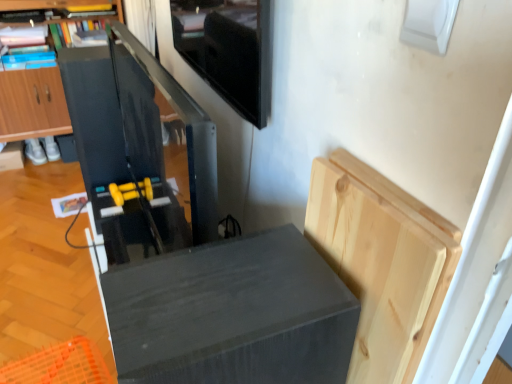
At what (x,y) coordinates should I click in order to perform the action: click on matte black cabinet at left, the 1th cabinetry in the left-to-right sequence. Please return your answer as a coordinate pair (x, y). This screenshot has height=384, width=512. Looking at the image, I should click on (32, 104).

Image resolution: width=512 pixels, height=384 pixels. What do you see at coordinates (32, 104) in the screenshot?
I see `matte black cabinet at left, the second cabinetry ordered from the bottom` at bounding box center [32, 104].

Identify the location of matte black speaker at lower center. (232, 314).

Where is `matte black cabinet at left, the 1th cabinetry in the left-to-right sequence`? Image resolution: width=512 pixels, height=384 pixels. matte black cabinet at left, the 1th cabinetry in the left-to-right sequence is located at coordinates (32, 104).

Can you confirm if matte black cabinet at left, arranged as the second cabinetry when viewed from the right, is wider than natural wood cutting board at upper right, positioned as the second cabinetry in back-to-front order?

Correct, the width of matte black cabinet at left, arranged as the second cabinetry when viewed from the right, exceeds that of natural wood cutting board at upper right, positioned as the second cabinetry in back-to-front order.

I want to click on cabinetry located behind the natural wood cutting board at upper right, positioned as the first cabinetry in front-to-back order, so click(x=32, y=104).

Between matte black cabinet at left, the 2th cabinetry positioned from the front, and natural wood cutting board at upper right, the 2th cabinetry positioned from the top, which one has more height?

matte black cabinet at left, the 2th cabinetry positioned from the front.

Can you tell me how much matte black cabinet at left, arranged as the 1th cabinetry when viewed from the top, and natural wood cutting board at upper right, the first cabinetry from the right, differ in facing direction?

The facing directions of matte black cabinet at left, arranged as the 1th cabinetry when viewed from the top, and natural wood cutting board at upper right, the first cabinetry from the right, are 91.6 degrees apart.

Considering the sizes of objects matte black speaker at lower center and matte black cabinet at left, the 1th cabinetry in the left-to-right sequence, in the image provided, who is smaller, matte black speaker at lower center or matte black cabinet at left, the 1th cabinetry in the left-to-right sequence,?

Smaller between the two is matte black speaker at lower center.

Is matte black speaker at lower center closer to the viewer compared to matte black cabinet at left, the second cabinetry ordered from the bottom?

Yes, it is in front of matte black cabinet at left, the second cabinetry ordered from the bottom.

From the image's perspective, does matte black speaker at lower center appear higher than matte black cabinet at left, arranged as the 1th cabinetry when viewed from the top?

No.

Is matte black cabinet at left, arranged as the 1th cabinetry when viewed from the top, a part of natural wood cutting board at upper right, the 1th cabinetry in the bottom-to-top sequence?

No, matte black cabinet at left, arranged as the 1th cabinetry when viewed from the top, is located outside of natural wood cutting board at upper right, the 1th cabinetry in the bottom-to-top sequence.

Is natural wood cutting board at upper right, which is the second cabinetry from left to right, looking in the opposite direction of matte black cabinet at left, arranged as the second cabinetry when viewed from the right?

No, matte black cabinet at left, arranged as the second cabinetry when viewed from the right, is not at the back of natural wood cutting board at upper right, which is the second cabinetry from left to right.

Between natural wood cutting board at upper right, the 1th cabinetry in the bottom-to-top sequence, and matte black cabinet at left, which is the 1th cabinetry in back-to-front order, which one has larger size?

matte black cabinet at left, which is the 1th cabinetry in back-to-front order, is bigger.

In the image, is natural wood cutting board at upper right, positioned as the first cabinetry in front-to-back order, positioned in front of or behind matte black cabinet at left, arranged as the second cabinetry when viewed from the right?

Visually, natural wood cutting board at upper right, positioned as the first cabinetry in front-to-back order, is located in front of matte black cabinet at left, arranged as the second cabinetry when viewed from the right.

Is matte black speaker at lower center not within natural wood cutting board at upper right, which is the second cabinetry from left to right?

Yes.

Considering the relative sizes of matte black speaker at lower center and natural wood cutting board at upper right, positioned as the first cabinetry in front-to-back order, in the image provided, is matte black speaker at lower center wider than natural wood cutting board at upper right, positioned as the first cabinetry in front-to-back order,?

Yes.

From the image's perspective, between matte black speaker at lower center and natural wood cutting board at upper right, which is the second cabinetry from left to right, who is located below?

matte black speaker at lower center.

Image resolution: width=512 pixels, height=384 pixels. What are the coordinates of `the 1st cabinetry above the matte black speaker at lower center (from the image's perspective)` in the screenshot? It's located at (381, 262).

Visually, is natural wood cutting board at upper right, positioned as the second cabinetry in back-to-front order, positioned to the left or to the right of matte black speaker at lower center?

Clearly, natural wood cutting board at upper right, positioned as the second cabinetry in back-to-front order, is on the right of matte black speaker at lower center in the image.

In the scene shown: Can you tell me how much natural wood cutting board at upper right, which is the second cabinetry from left to right, and matte black speaker at lower center differ in facing direction?

The angular difference between natural wood cutting board at upper right, which is the second cabinetry from left to right, and matte black speaker at lower center is 0.00173 degrees.

Which object is closer to the camera taking this photo, natural wood cutting board at upper right, positioned as the first cabinetry in front-to-back order, or matte black speaker at lower center?

matte black speaker at lower center is more forward.

From the image's perspective, is natural wood cutting board at upper right, the 2th cabinetry positioned from the top, above or below matte black speaker at lower center?

Clearly, from the image's perspective, natural wood cutting board at upper right, the 2th cabinetry positioned from the top, is above matte black speaker at lower center.

From the image's perspective, between matte black cabinet at left, the 1th cabinetry in the left-to-right sequence, and matte black speaker at lower center, which one is located above?

matte black cabinet at left, the 1th cabinetry in the left-to-right sequence.

Between matte black cabinet at left, arranged as the second cabinetry when viewed from the right, and matte black speaker at lower center, which one appears on the right side from the viewer's perspective?

Positioned to the right is matte black speaker at lower center.

I want to click on furniture that appears above the matte black cabinet at left, the second cabinetry ordered from the bottom (from a real-world perspective), so click(x=232, y=314).

The width and height of the screenshot is (512, 384). I want to click on cabinetry below the natural wood cutting board at upper right, the first cabinetry from the right (from a real-world perspective), so click(x=32, y=104).

Identify the location of furniture below the matte black cabinet at left, the second cabinetry ordered from the bottom (from the image's perspective). (232, 314).

From the image, which object appears to be farther from matte black cabinet at left, the second cabinetry ordered from the bottom, natural wood cutting board at upper right, the 2th cabinetry positioned from the top, or matte black speaker at lower center?

natural wood cutting board at upper right, the 2th cabinetry positioned from the top.

Based on their spatial positions, is matte black cabinet at left, the 2th cabinetry positioned from the front, or natural wood cutting board at upper right, positioned as the second cabinetry in back-to-front order, further from matte black speaker at lower center?

matte black cabinet at left, the 2th cabinetry positioned from the front, is positioned further to the anchor matte black speaker at lower center.

Looking at the image, which one is located closer to matte black speaker at lower center, natural wood cutting board at upper right, which is the second cabinetry from left to right, or matte black cabinet at left, the 1th cabinetry in the left-to-right sequence?

The object closer to matte black speaker at lower center is natural wood cutting board at upper right, which is the second cabinetry from left to right.

Considering their positions, is matte black speaker at lower center positioned further to natural wood cutting board at upper right, the first cabinetry from the right, than matte black cabinet at left, the 2th cabinetry positioned from the front?

matte black cabinet at left, the 2th cabinetry positioned from the front, is further to natural wood cutting board at upper right, the first cabinetry from the right.

When comparing their distances from natural wood cutting board at upper right, the first cabinetry from the right, does matte black cabinet at left, which is the 1th cabinetry in back-to-front order, or matte black speaker at lower center seem further?

matte black cabinet at left, which is the 1th cabinetry in back-to-front order.

Estimate the real-world distances between objects in this image. Which object is closer to matte black cabinet at left, arranged as the 1th cabinetry when viewed from the top, matte black speaker at lower center or natural wood cutting board at upper right, the first cabinetry from the right?

matte black speaker at lower center is positioned closer to the anchor matte black cabinet at left, arranged as the 1th cabinetry when viewed from the top.

The height and width of the screenshot is (384, 512). Identify the location of cabinetry between matte black speaker at lower center and matte black cabinet at left, the second cabinetry ordered from the bottom, along the z-axis. point(381,262).